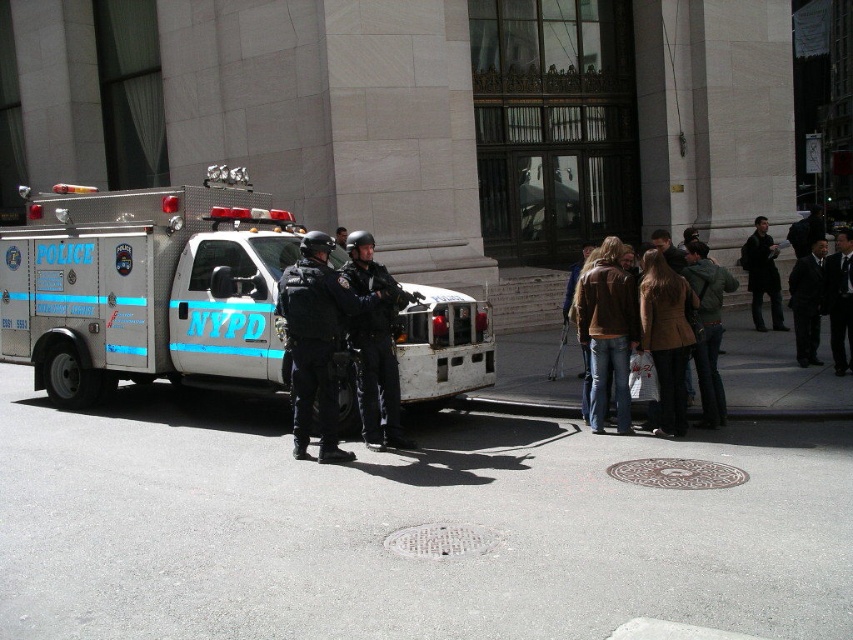
Does brown leather jacket at center have a smaller size compared to dark brown leather jacket at right?

Correct, brown leather jacket at center occupies less space than dark brown leather jacket at right.

Is point (663, 369) behind point (776, 301)?

No, (663, 369) is closer to viewer.

This screenshot has height=640, width=853. What are the coordinates of `brown leather jacket at center` in the screenshot? It's located at (666, 339).

Which is more to the left, brown suede jacket at lower right or brown leather jacket at center?

brown suede jacket at lower right is more to the left.

Who is taller, brown suede jacket at lower right or brown leather jacket at center?

With more height is brown suede jacket at lower right.

From the picture: Who is more forward, (x=592, y=275) or (x=643, y=278)?

Point (x=643, y=278)

Locate an element on the screen. Image resolution: width=853 pixels, height=640 pixels. brown suede jacket at lower right is located at coordinates [607, 332].

Between brown suede jacket at lower right and black smooth suit at right, which one is positioned higher?

black smooth suit at right is higher up.

The image size is (853, 640). What do you see at coordinates (607, 332) in the screenshot?
I see `brown suede jacket at lower right` at bounding box center [607, 332].

The height and width of the screenshot is (640, 853). What are the coordinates of `brown suede jacket at lower right` in the screenshot? It's located at (607, 332).